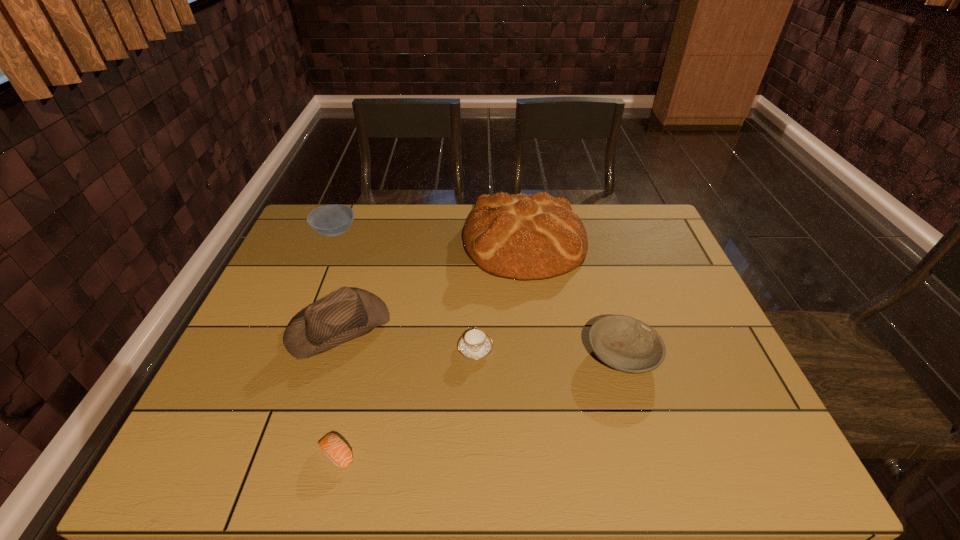
Locate an element on the screen. This screenshot has height=540, width=960. the tallest object is located at coordinates (523, 237).

Image resolution: width=960 pixels, height=540 pixels. I want to click on fedora, so click(x=347, y=313).

Locate an element on the screen. the third tallest object is located at coordinates (331, 220).

The image size is (960, 540). I want to click on the left bowl, so click(331, 220).

I want to click on the third shortest object, so (x=628, y=345).

I want to click on the nearer bowl, so click(628, 345).

You are a GUI agent. You are given a task and a screenshot of the screen. Output one action in this format:
    pyautogui.click(x=<x>, y=<y>)
    Task: Click on the teacup
    
    Given the screenshot: What is the action you would take?
    pyautogui.click(x=475, y=344)

You are a GUI agent. You are given a task and a screenshot of the screen. Output one action in this format:
    pyautogui.click(x=<x>, y=<y>)
    Task: Click on the sushi
    
    Given the screenshot: What is the action you would take?
    pyautogui.click(x=335, y=449)

At what (x,y) coordinates should I click in order to perform the action: click on the nearest object. Please return your answer as a coordinate pair (x, y). The width and height of the screenshot is (960, 540). Looking at the image, I should click on pos(335,449).

Locate an element on the screen. The image size is (960, 540). free space located on the right of the bread is located at coordinates (667, 241).